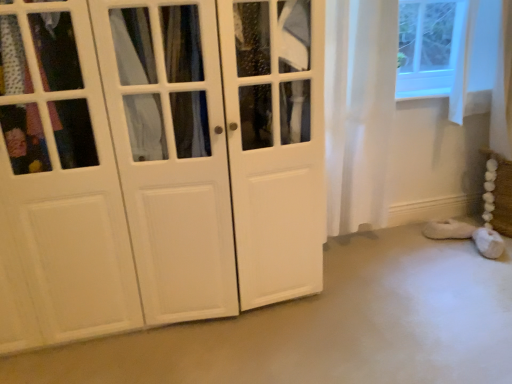
Where is `free spot below white fluffy slipper at lower right (from a real-world perspective)`? The height and width of the screenshot is (384, 512). free spot below white fluffy slipper at lower right (from a real-world perspective) is located at coordinates coord(443,240).